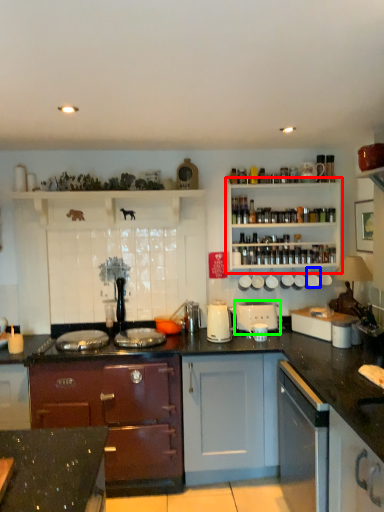
Question: Which object is the closest to the shelf (highlighted by a red box)? Choose among these: appliance (highlighted by a blue box) or appliance (highlighted by a green box).

Choices:
 (A) appliance
 (B) appliance

Answer: (A)